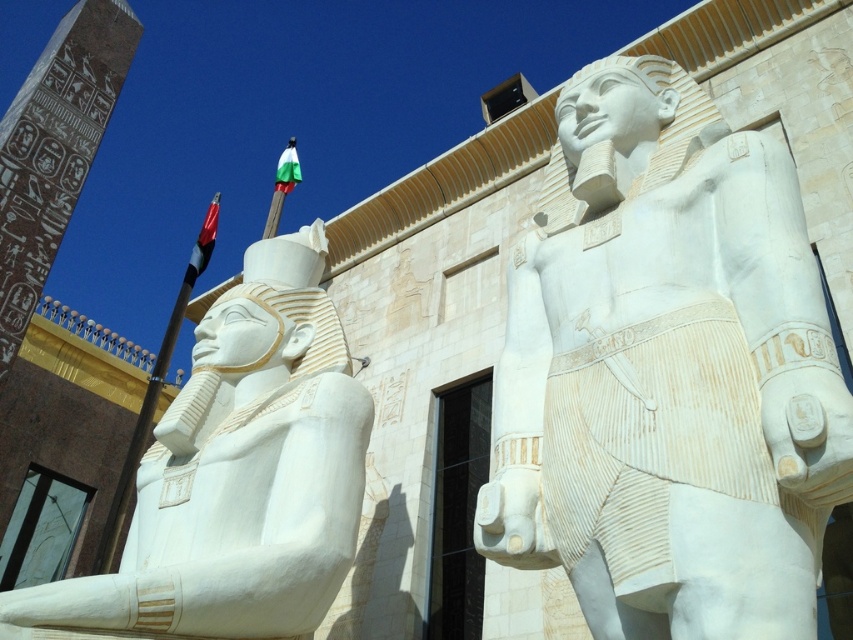
Question: Is white marble statue at center to the left of white marble statue at left from the viewer's perspective?

Choices:
 (A) no
 (B) yes

Answer: (A)

Question: Does white marble statue at center appear on the right side of white marble statue at left?

Choices:
 (A) no
 (B) yes

Answer: (B)

Question: From the image, what is the correct spatial relationship of white marble statue at center in relation to white marble statue at left?

Choices:
 (A) above
 (B) below

Answer: (A)

Question: Which point is closer to the camera?

Choices:
 (A) white marble statue at center
 (B) white marble statue at left

Answer: (A)

Question: Which point is closer to the camera taking this photo?

Choices:
 (A) tap(282, 550)
 (B) tap(560, 465)

Answer: (B)

Question: Which point is closer to the camera taking this photo?

Choices:
 (A) (611, 134)
 (B) (210, 362)

Answer: (A)